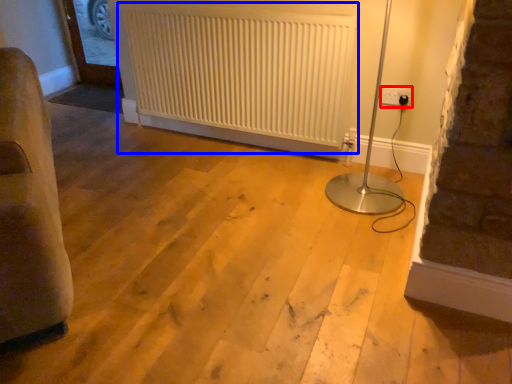
Question: Which of the following is the closest to the observer, electric outlet (highlighted by a red box) or radiator (highlighted by a blue box)?

Choices:
 (A) electric outlet
 (B) radiator

Answer: (B)